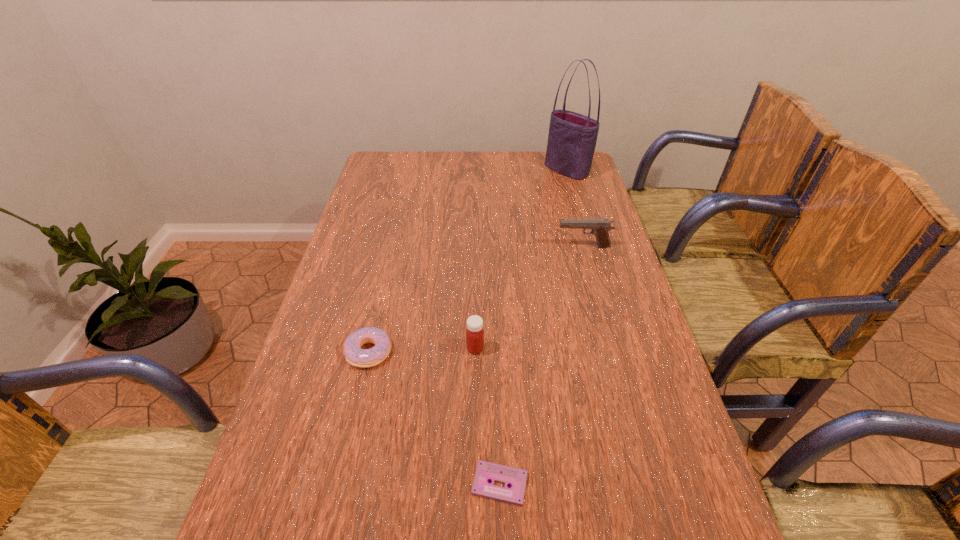
Locate an element on the screen. This screenshot has width=960, height=540. vacant space at the far edge is located at coordinates (492, 156).

Identify the location of vacant space at the left edge. This screenshot has height=540, width=960. (335, 279).

Where is `free space at the right edge of the desktop`? This screenshot has height=540, width=960. free space at the right edge of the desktop is located at coordinates (582, 213).

The width and height of the screenshot is (960, 540). I want to click on free space between the doughnut and the medicine, so click(x=422, y=350).

The image size is (960, 540). What are the coordinates of `unoccupied area between the second farthest object and the medicine` in the screenshot? It's located at (529, 298).

I want to click on vacant region between the leftmost object and the second farthest object, so click(476, 299).

At what (x,y) coordinates should I click in order to perform the action: click on free spot between the pistol and the videotape. Please return your answer as a coordinate pair (x, y). Looking at the image, I should click on click(x=541, y=365).

You are a GUI agent. You are given a task and a screenshot of the screen. Output one action in this format:
    pyautogui.click(x=<x>, y=<y>)
    Task: Click on the vacant space in between the shortest object and the leftmost object
    The width and height of the screenshot is (960, 540).
    Given the screenshot: What is the action you would take?
    pyautogui.click(x=435, y=418)

Identify the location of free spot between the pistol and the videotape. (541, 365).

This screenshot has height=540, width=960. Find the location of `free point between the nearest object and the medicine`. free point between the nearest object and the medicine is located at coordinates (488, 416).